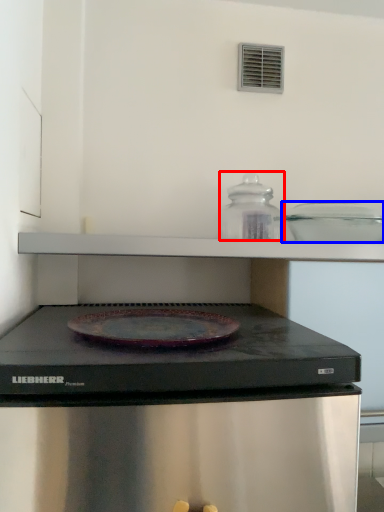
Question: Among these objects, which one is farthest to the camera, appliance (highlighted by a red box) or appliance (highlighted by a blue box)?

Choices:
 (A) appliance
 (B) appliance

Answer: (A)